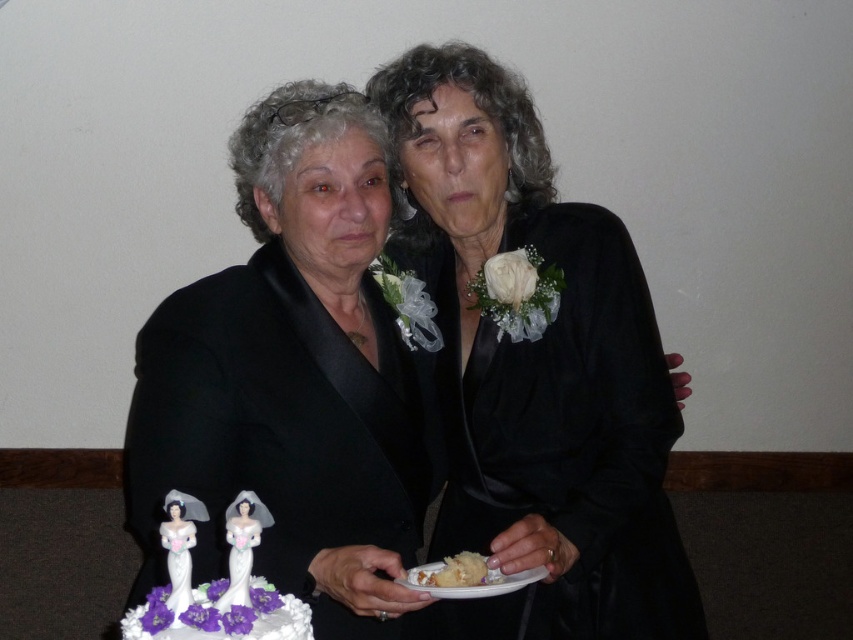
Does point (549, 502) come farther from viewer compared to point (190, 508)?

Yes, it is behind point (190, 508).

Is black satin suit at center further to camera compared to white fondant cake at lower center?

Yes.

You are a GUI agent. You are given a task and a screenshot of the screen. Output one action in this format:
    pyautogui.click(x=<x>, y=<y>)
    Task: Click on the black satin suit at center
    Image resolution: width=853 pixels, height=640 pixels.
    Given the screenshot: What is the action you would take?
    pyautogui.click(x=402, y=390)

Locate an element on the screen. This screenshot has height=640, width=853. black satin suit at center is located at coordinates (402, 390).

Does black satin suit at center have a greater height compared to white fluffy cake at center?

Yes, black satin suit at center is taller than white fluffy cake at center.

Consider the image. Is black satin suit at center below white fluffy cake at center?

No.

Is point (345, 289) farther from viewer compared to point (447, 570)?

Yes, it is behind point (447, 570).

Image resolution: width=853 pixels, height=640 pixels. I want to click on black satin suit at center, so click(402, 390).

Looking at this image, can you confirm if white fondant cake at lower center is positioned to the left of white fluffy cake at center?

Correct, you'll find white fondant cake at lower center to the left of white fluffy cake at center.

Between point (277, 636) and point (445, 582), which one is positioned in front?

Positioned in front is point (277, 636).

Where is `white fondant cake at lower center`? The image size is (853, 640). white fondant cake at lower center is located at coordinates (216, 582).